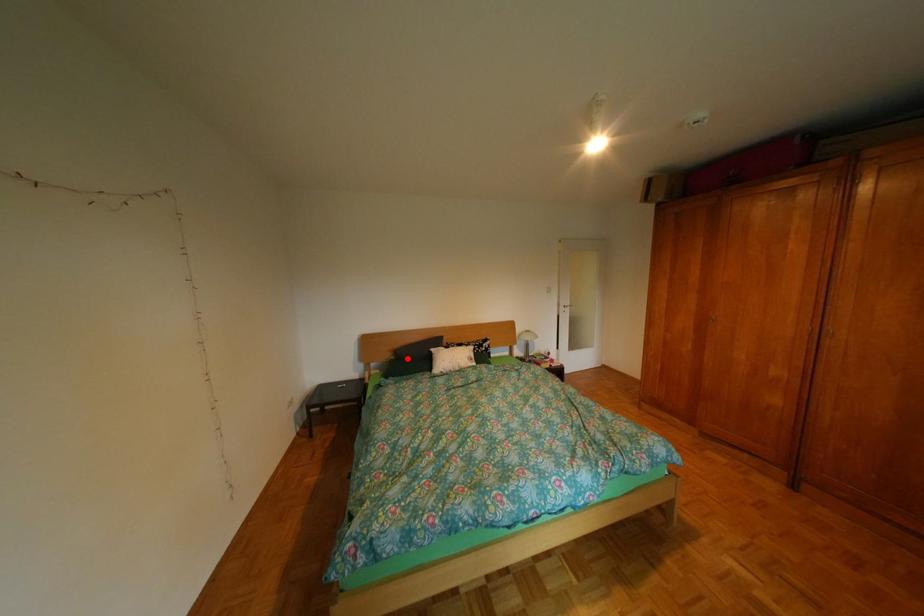
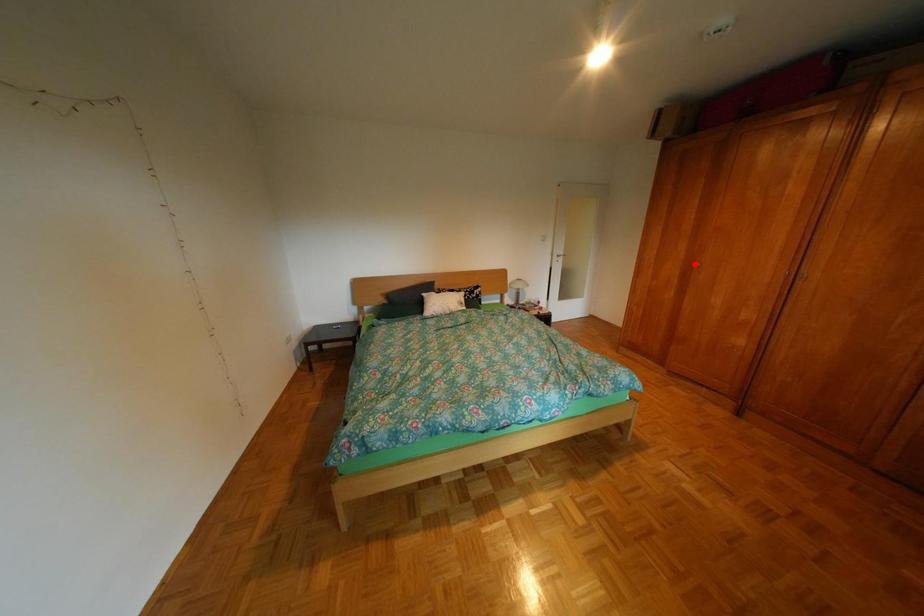
I am providing you with two images of the same scene from different viewpoints. A red point is marked on the first image and another point is marked on the second image. Does the point marked in image1 correspond to the same location as the one in image2?

No